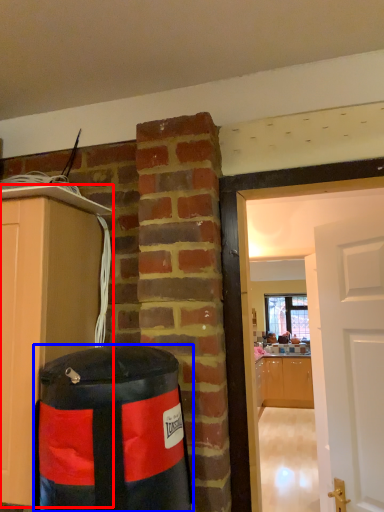
Question: Which object is further to the camera taking this photo, cabinetry (highlighted by a red box) or punching bag (highlighted by a blue box)?

Choices:
 (A) cabinetry
 (B) punching bag

Answer: (A)